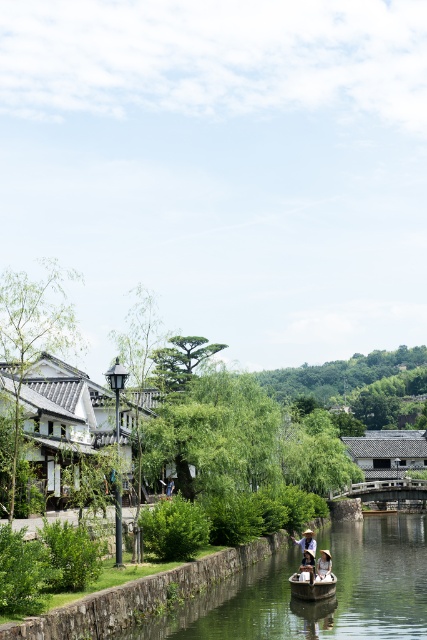
You are standing on the riverside and want to throw a stone to hit both the white straw hat at center and the light brown wooden boat at lower center. Can you do it in one throw?

The white straw hat at center is 14.98 feet away from the light brown wooden boat at lower center. Since the distance between them is significant, you would need to throw the stone with enough force to cover that distance, but it would require precise aim to hit both targets in a single throw.

You are planning to cross the river using a boat. You see a wooden canoe at lower center and a light brown wooden boat at lower center. Which one is longer and can potentially carry more passengers?

The light brown wooden boat at lower center is longer than the wooden canoe at lower center, so it can potentially carry more passengers.

You are standing on the riverside and want to take a photo of the wooden canoe at lower center and the white woven hat at center. Which object should you focus on first to ensure both are in the frame?

You should focus on the wooden canoe at lower center first because it is closer to you than the white woven hat at center, so adjusting the camera to include it will naturally bring the hat into view as well.